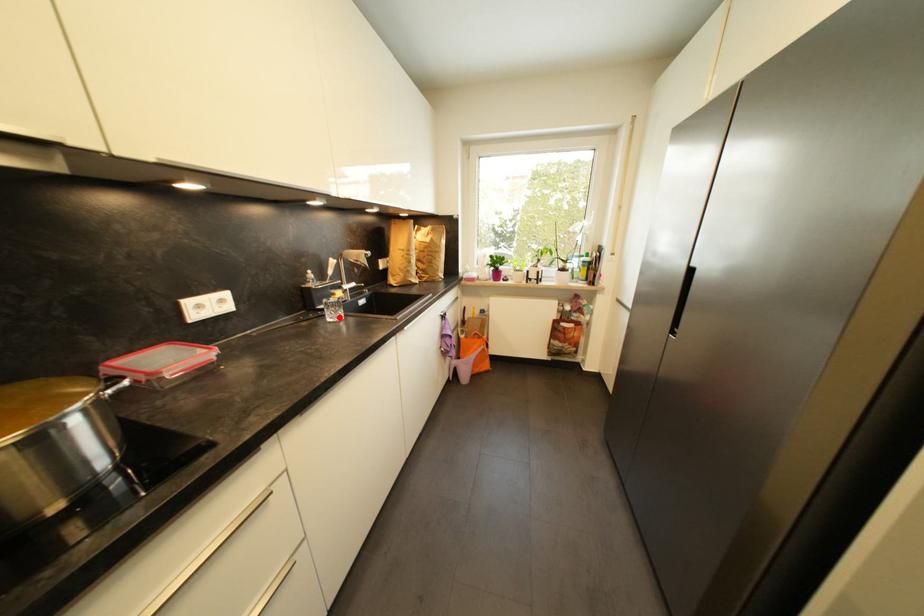
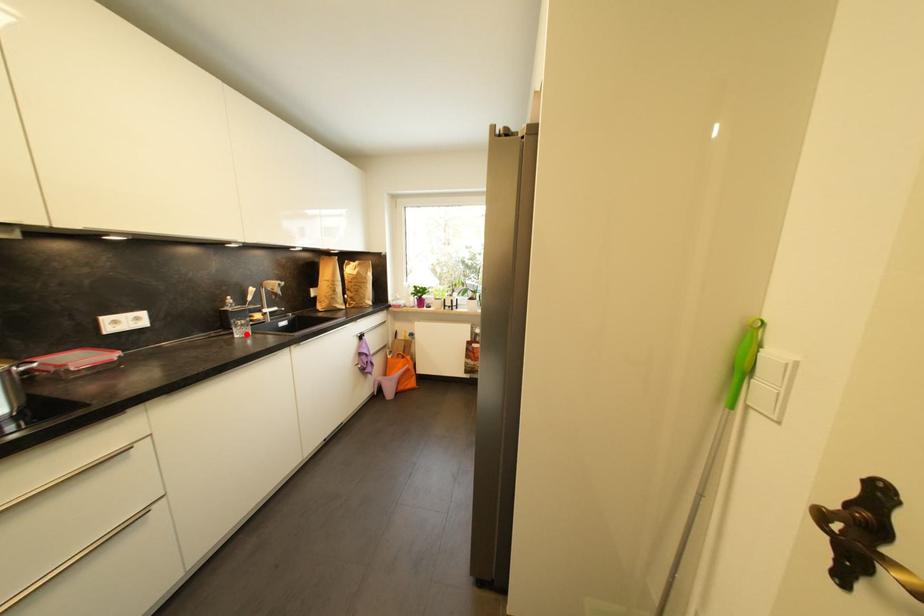
I am providing you with two images of the same scene from different viewpoints. A red point is marked on the first image and another point is marked on the second image. Is the red point in image1 aligned with the point shown in image2?

Yes